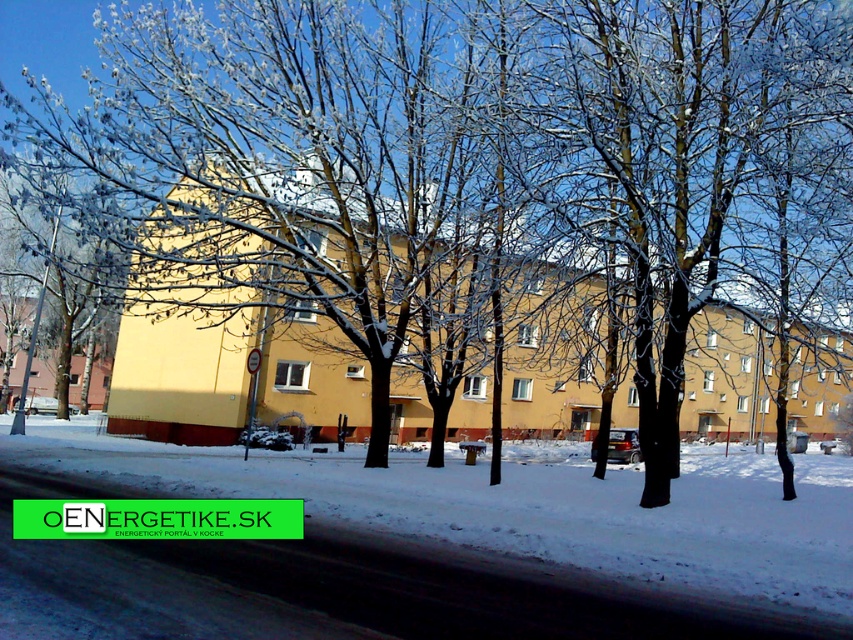
You are a delivery person trying to park your 2.5 meter wide truck near the white powdery snow at center and the white frosty tree at left. Which area between them has enough space for your truck?

The white powdery snow at center has a width that surpasses the white frosty tree at left, so the area near the white powdery snow at center can accommodate the 2.5 meter wide truck.

You are a delivery person trying to navigate to the building with a light yellow facade. You see the white powdery snow at center and the white frosty tree at left. Which object is located to the right of the other?

The white powdery snow at center is positioned on the right side of white frosty tree at left.

You are a delivery drone trying to land on the white powdery snow at center. The landing coordinates must be within 0.1 units of the specified point. Can you land safely?

The white powdery snow at center is located at point [526,508], so the drone can land safely as long as it targets within 0.1 units of that coordinate.